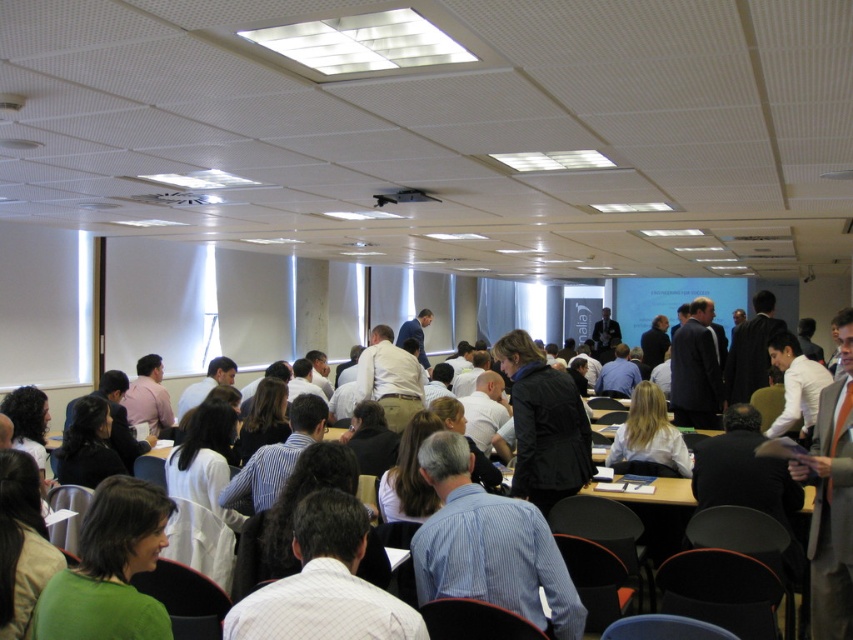
Question: Which is nearer to the blue striped shirt at center?

Choices:
 (A) dark brown leather jacket at center
 (B) green matte shirt at lower left
 (C) blonde hair at center
 (D) white striped shirt at center

Answer: (D)

Question: Can you confirm if blue striped shirt at center is thinner than blonde hair at center?

Choices:
 (A) yes
 (B) no

Answer: (B)

Question: Which object appears farthest from the camera in this image?

Choices:
 (A) blonde hair at center
 (B) green matte shirt at lower left

Answer: (A)

Question: Is green matte shirt at lower left above dark brown leather jacket at center?

Choices:
 (A) no
 (B) yes

Answer: (A)

Question: Estimate the real-world distances between objects in this image. Which object is closer to the dark brown leather jacket at center?

Choices:
 (A) blue striped shirt at center
 (B) green matte shirt at lower left

Answer: (A)

Question: Can you confirm if blue striped shirt at center is positioned to the right of blonde hair at center?

Choices:
 (A) no
 (B) yes

Answer: (A)